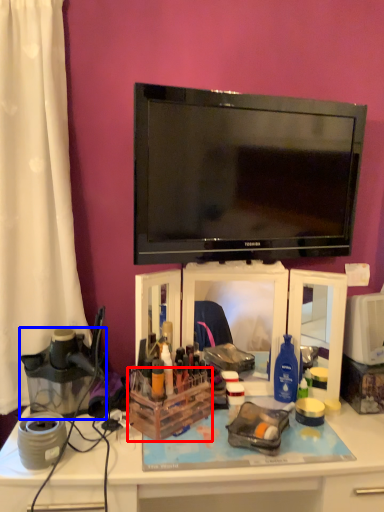
Question: Which point is further to the camera, storage box (highlighted by a red box) or appliance (highlighted by a blue box)?

Choices:
 (A) storage box
 (B) appliance

Answer: (A)